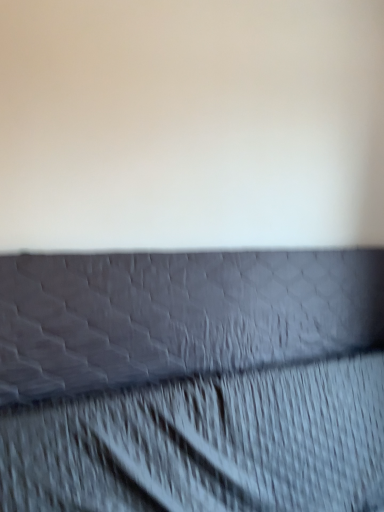
This screenshot has height=512, width=384. In order to click on textured fabric at lower center in this screenshot , I will do `click(192, 382)`.

Image resolution: width=384 pixels, height=512 pixels. Describe the element at coordinates (192, 382) in the screenshot. I see `textured fabric at lower center` at that location.

What is the approximate width of textured fabric at lower center?

textured fabric at lower center is 33.19 inches in width.

Where is `textured fabric at lower center`? textured fabric at lower center is located at coordinates (192, 382).